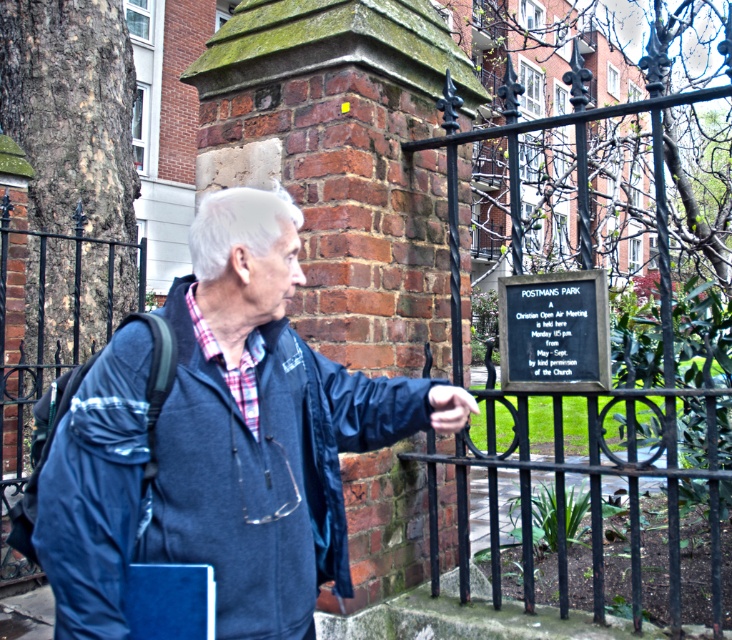
Question: Is blue fleece jacket at lower left thinner than black wrought iron fence at center?

Choices:
 (A) yes
 (B) no

Answer: (A)

Question: Which point is farther from the camera taking this photo?

Choices:
 (A) (597, 273)
 (B) (436, 394)

Answer: (A)

Question: Among these points, which one is nearest to the camera?

Choices:
 (A) (530, 580)
 (B) (40, 369)
 (C) (72, 532)
 (D) (458, 406)

Answer: (C)

Question: Which object is positioned closest to the smooth skin hand at center?

Choices:
 (A) black wrought iron fence at center
 (B) black metal fence at left
 (C) blue fleece jacket at lower left
 (D) black polished stone plaque at center

Answer: (C)

Question: Is black metal fence at left positioned in front of black polished stone plaque at center?

Choices:
 (A) yes
 (B) no

Answer: (B)

Question: Does black wrought iron fence at center have a smaller size compared to smooth skin hand at center?

Choices:
 (A) no
 (B) yes

Answer: (A)